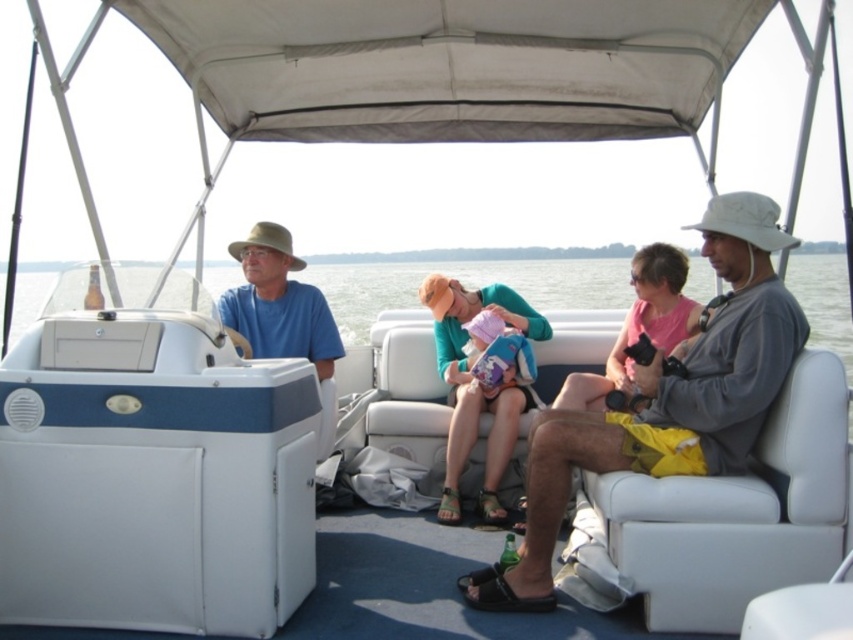
Is point (495, 468) positioned before point (651, 316)?

Yes, it is.

Which is behind, point (444, 342) or point (616, 342)?

Positioned behind is point (444, 342).

The width and height of the screenshot is (853, 640). Find the location of `matte green sweater at center`. matte green sweater at center is located at coordinates (477, 384).

Between point (456, 275) and point (630, 307), which one is positioned behind?

Point (456, 275)

Between clear water at center and pink fabric bag at center, which one is positioned higher?

clear water at center is above.

I want to click on clear water at center, so click(x=469, y=285).

Is gray fabric hat at center thinner than clear water at center?

Yes.

The width and height of the screenshot is (853, 640). Find the location of `gray fabric hat at center`. gray fabric hat at center is located at coordinates (666, 401).

Does point (556, 408) lie in front of point (462, 278)?

Yes.

This screenshot has height=640, width=853. Find the location of `gray fabric hat at center`. gray fabric hat at center is located at coordinates (666, 401).